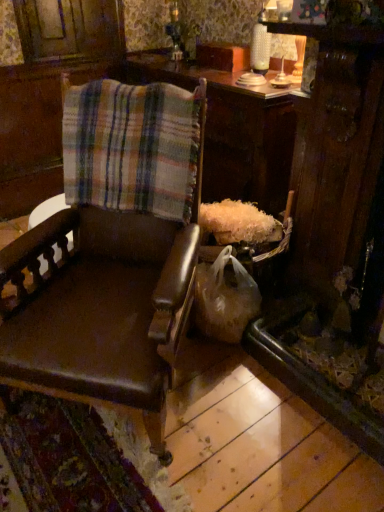
Question: Is wooden table at center next to brown leather chair at left?

Choices:
 (A) no
 (B) yes

Answer: (A)

Question: Would you consider wooden table at center to be distant from brown leather chair at left?

Choices:
 (A) no
 (B) yes

Answer: (A)

Question: From a real-world perspective, is wooden table at center beneath brown leather chair at left?

Choices:
 (A) no
 (B) yes

Answer: (B)

Question: Considering the relative sizes of wooden table at center and brown leather chair at left in the image provided, is wooden table at center thinner than brown leather chair at left?

Choices:
 (A) no
 (B) yes

Answer: (B)

Question: Is brown leather chair at left at the back of wooden table at center?

Choices:
 (A) yes
 (B) no

Answer: (B)

Question: Is wooden table at center located outside brown leather chair at left?

Choices:
 (A) yes
 (B) no

Answer: (A)

Question: Is brown leather chair at left looking in the opposite direction of plaid fabric at center?

Choices:
 (A) no
 (B) yes

Answer: (B)

Question: From a real-world perspective, is brown leather chair at left on plaid fabric at center?

Choices:
 (A) yes
 (B) no

Answer: (B)

Question: Does brown leather chair at left appear on the left side of plaid fabric at center?

Choices:
 (A) no
 (B) yes

Answer: (B)

Question: From the image's perspective, is brown leather chair at left on top of plaid fabric at center?

Choices:
 (A) yes
 (B) no

Answer: (B)

Question: Can you confirm if brown leather chair at left is shorter than plaid fabric at center?

Choices:
 (A) no
 (B) yes

Answer: (A)

Question: Would you say plaid fabric at center is part of brown leather chair at left's contents?

Choices:
 (A) yes
 (B) no

Answer: (A)

Question: From a real-world perspective, is brown leather chair at left under wooden table at center?

Choices:
 (A) no
 (B) yes

Answer: (A)